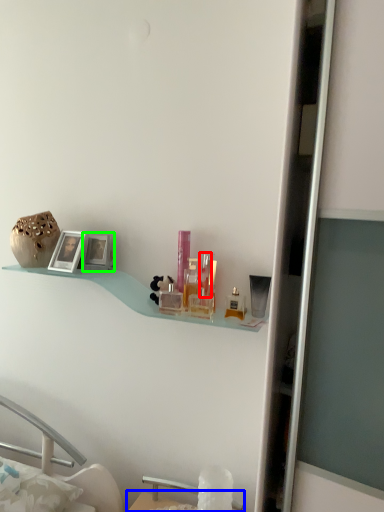
Question: Considering the real-world distances, which object is closest to toiletry (highlighted by a red box)? table (highlighted by a blue box) or picture frame (highlighted by a green box).

Choices:
 (A) table
 (B) picture frame

Answer: (B)